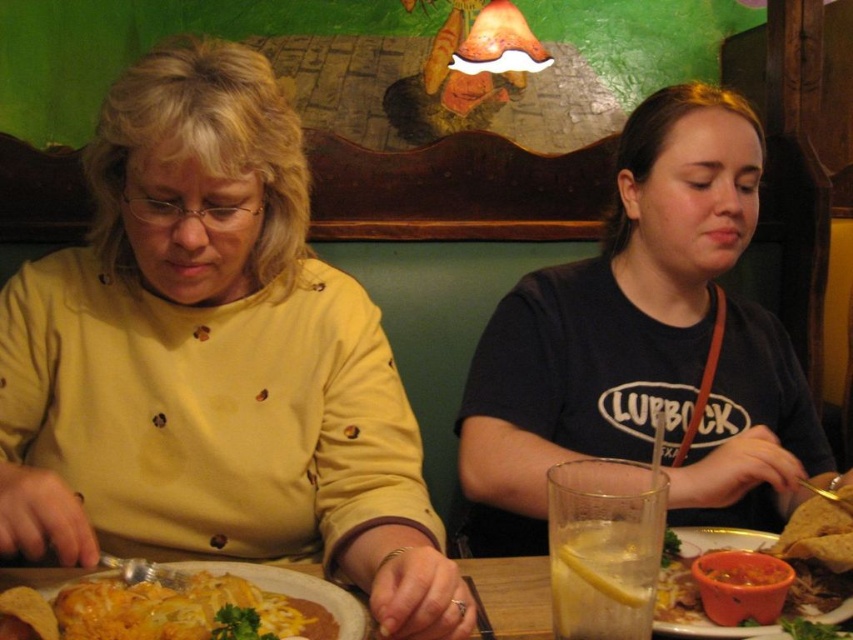
Between yellow matte shirt at center and cheesy tortilla at lower left, which one is positioned lower?

cheesy tortilla at lower left is below.

Is yellow matte shirt at center shorter than cheesy tortilla at lower left?

No, yellow matte shirt at center is not shorter than cheesy tortilla at lower left.

At what (x,y) coordinates should I click in order to perform the action: click on yellow matte shirt at center. Please return your answer as a coordinate pair (x, y). Looking at the image, I should click on (212, 362).

Can you confirm if black cotton shirt at center is positioned above wooden table at center?

Indeed, black cotton shirt at center is positioned over wooden table at center.

Between black cotton shirt at center and wooden table at center, which one appears on the right side from the viewer's perspective?

Positioned to the right is black cotton shirt at center.

Is point (732, 449) positioned after point (498, 560)?

Yes, point (732, 449) is behind point (498, 560).

The height and width of the screenshot is (640, 853). I want to click on black cotton shirt at center, so click(646, 346).

Can you confirm if cheesy tortilla at lower left is bigger than wooden table at center?

Incorrect, cheesy tortilla at lower left is not larger than wooden table at center.

Can you confirm if cheesy tortilla at lower left is positioned above wooden table at center?

Correct, cheesy tortilla at lower left is located above wooden table at center.

Between point (114, 621) and point (503, 595), which one is positioned in front?

Point (114, 621)

In order to click on cheesy tortilla at lower left in this screenshot , I will do `click(184, 611)`.